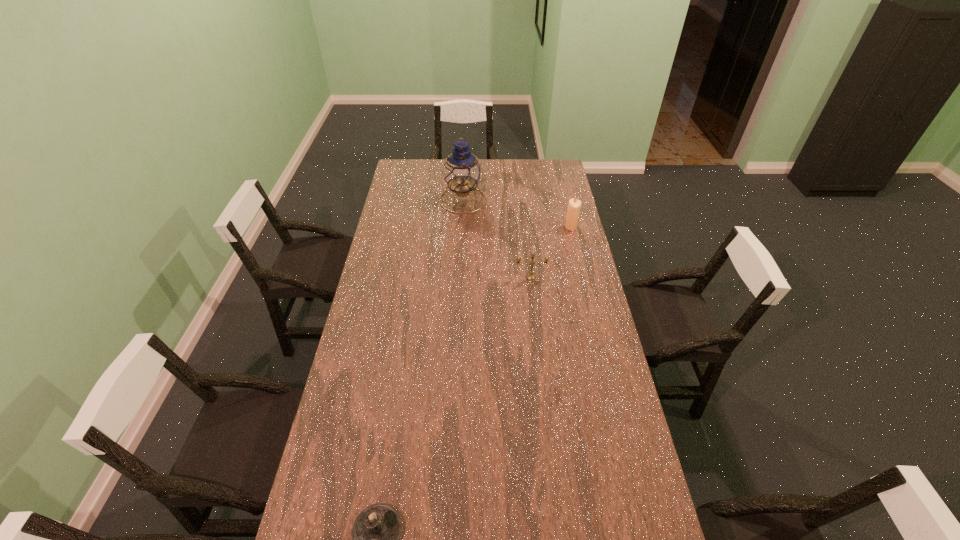
The height and width of the screenshot is (540, 960). In order to click on vacant space at the left edge in this screenshot , I will do `click(380, 276)`.

In order to click on free space at the right edge of the desktop in this screenshot , I will do `click(556, 189)`.

Find the location of `vacant space at the far right corner of the desktop`. vacant space at the far right corner of the desktop is located at coordinates (541, 176).

Identify the location of free space that is in between the second farthest candle and the tallest object. click(x=497, y=239).

Where is `vacant area between the farthest candle and the second nearest candle`? This screenshot has width=960, height=540. vacant area between the farthest candle and the second nearest candle is located at coordinates (551, 252).

Find the location of a particular element. The height and width of the screenshot is (540, 960). empty space between the second object from right to left and the rightmost candle is located at coordinates (551, 252).

Find the location of a particular element. the closest object to the rightmost candle is located at coordinates (530, 276).

Identify the location of the third closest object to the second candle from right to left. The image size is (960, 540). (376, 531).

Choose which candle is the second nearest neighbor to the farthest object. Please provide its 2D coordinates. Your answer should be formatted as a tuple, i.e. [(x, y)], where the tuple contains the x and y coordinates of a point satisfying the conditions above.

[(530, 276)]

The height and width of the screenshot is (540, 960). What are the coordinates of `the second closest candle to the farthest candle` in the screenshot? It's located at (376, 531).